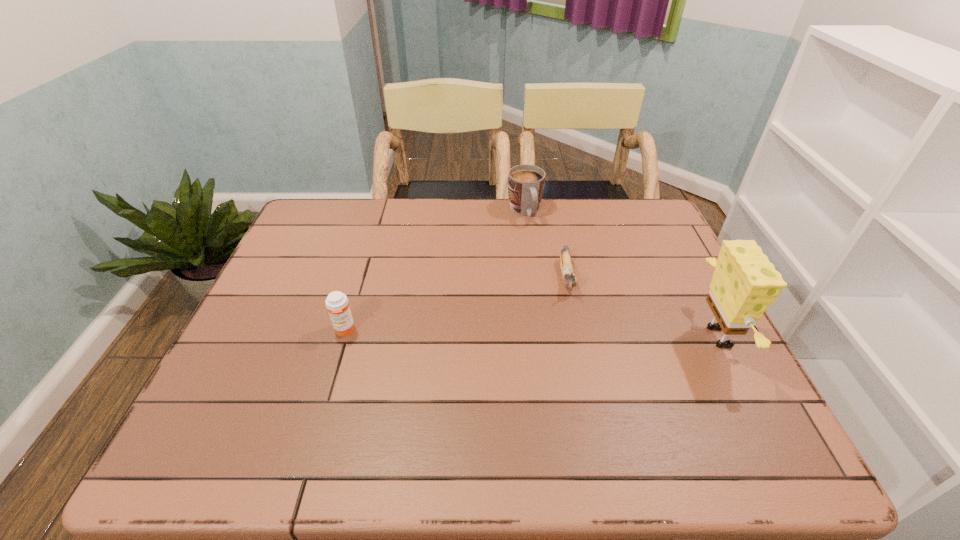
This screenshot has width=960, height=540. What are the coordinates of `medicine` in the screenshot? It's located at (337, 303).

Image resolution: width=960 pixels, height=540 pixels. What are the coordinates of `the tallest object` in the screenshot? It's located at (744, 283).

Find the location of a particular element. sponge is located at coordinates (x=744, y=283).

Image resolution: width=960 pixels, height=540 pixels. What are the coordinates of `the second object from left to right` in the screenshot? It's located at [x=526, y=183].

I want to click on mug, so click(526, 183).

This screenshot has height=540, width=960. Find the location of `the second object from right to left`. the second object from right to left is located at coordinates (567, 272).

Where is `banana`? The width and height of the screenshot is (960, 540). banana is located at coordinates (567, 272).

The width and height of the screenshot is (960, 540). I want to click on free spot located 0.140m on the front of the leftmost object, so click(326, 390).

Identify the location of blank space located on the side of the mug with the handle. (570, 313).

The width and height of the screenshot is (960, 540). I want to click on free space located on the side of the mug with the handle, so click(x=549, y=267).